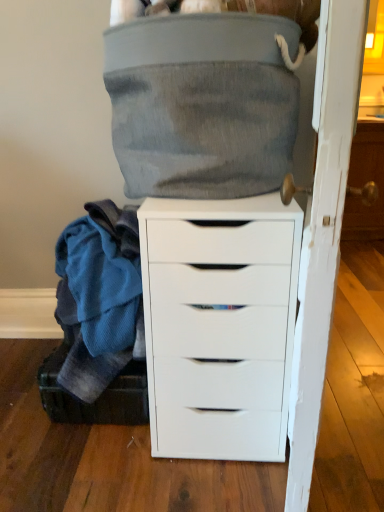
The image size is (384, 512). I want to click on white wood door at right, so click(x=323, y=229).

This screenshot has height=512, width=384. In order to click on white matte chest of drawers at center in this screenshot , I will do `click(219, 324)`.

From a real-world perspective, is black fabric shoe box at lower left physically located above or below white matte chest of drawers at center?

In terms of real-world spatial position, black fabric shoe box at lower left is below white matte chest of drawers at center.

Is black fabric shoe box at lower left facing away from white matte chest of drawers at center?

No, black fabric shoe box at lower left is not facing the opposite direction of white matte chest of drawers at center.

Which of these two, black fabric shoe box at lower left or white matte chest of drawers at center, is smaller?

black fabric shoe box at lower left.

Based on the photo, is white matte chest of drawers at center surrounded by black fabric shoe box at lower left?

No, white matte chest of drawers at center is not inside black fabric shoe box at lower left.

From a real-world perspective, between white matte chest of drawers at center and white wood door at right, who is vertically higher?

In real-world perspective, white wood door at right is above.

Can you confirm if white matte chest of drawers at center is wider than white wood door at right?

Yes.

There is a white matte chest of drawers at center. Identify the location of door above it (from a real-world perspective). This screenshot has width=384, height=512. (323, 229).

Can we say white matte chest of drawers at center lies outside white wood door at right?

Yes, white matte chest of drawers at center is outside of white wood door at right.

From a real-world perspective, is black fabric shoe box at lower left physically below white wood door at right?

Yes, from a real-world perspective, black fabric shoe box at lower left is under white wood door at right.

Which is closer to the camera, (53,410) or (345,92)?

Point (345,92)

Considering the relative sizes of black fabric shoe box at lower left and white wood door at right in the image provided, is black fabric shoe box at lower left shorter than white wood door at right?

Yes, black fabric shoe box at lower left is shorter than white wood door at right.

From the image's perspective, between white matte chest of drawers at center and black fabric shoe box at lower left, who is located below?

From the image's view, black fabric shoe box at lower left is below.

Does white matte chest of drawers at center touch black fabric shoe box at lower left?

No.

Which is correct: white matte chest of drawers at center is inside black fabric shoe box at lower left, or outside of it?

white matte chest of drawers at center lies outside black fabric shoe box at lower left.

Which object is thinner, white matte chest of drawers at center or black fabric shoe box at lower left?

black fabric shoe box at lower left is thinner.

Is white wood door at right inside or outside of black fabric shoe box at lower left?

white wood door at right is outside black fabric shoe box at lower left.

From a real-world perspective, is white wood door at right over black fabric shoe box at lower left?

Yes, from a real-world perspective, white wood door at right is over black fabric shoe box at lower left

Considering the sizes of objects white wood door at right and black fabric shoe box at lower left in the image provided, who is shorter, white wood door at right or black fabric shoe box at lower left?

black fabric shoe box at lower left is shorter.

Does white wood door at right have a greater height compared to white matte chest of drawers at center?

Correct, white wood door at right is much taller as white matte chest of drawers at center.

Would you say white wood door at right is outside white matte chest of drawers at center?

Yes, white wood door at right is outside of white matte chest of drawers at center.

From the image's perspective, does white wood door at right appear lower than white matte chest of drawers at center?

No.

Is white wood door at right placed right next to white matte chest of drawers at center?

No, white wood door at right is not in contact with white matte chest of drawers at center.

At what (x,y) coordinates should I click in order to perform the action: click on shoe box below the white matte chest of drawers at center (from a real-world perspective). Please return your answer as a coordinate pair (x, y). This screenshot has height=512, width=384. Looking at the image, I should click on (98, 398).

You are a GUI agent. You are given a task and a screenshot of the screen. Output one action in this format:
    pyautogui.click(x=<x>, y=<y>)
    Task: Click on the door on the right of white matte chest of drawers at center
    This screenshot has height=512, width=384.
    Given the screenshot: What is the action you would take?
    pyautogui.click(x=323, y=229)

Considering their positions, is white wood door at right positioned closer to black fabric shoe box at lower left than white matte chest of drawers at center?

Based on the image, white matte chest of drawers at center appears to be nearer to black fabric shoe box at lower left.

Considering their positions, is white matte chest of drawers at center positioned closer to black fabric shoe box at lower left than white wood door at right?

Among the two, white matte chest of drawers at center is located nearer to black fabric shoe box at lower left.

From the image, which object appears to be farther from white wood door at right, white matte chest of drawers at center or black fabric shoe box at lower left?

black fabric shoe box at lower left.

Based on their spatial positions, is black fabric shoe box at lower left or white wood door at right further from white matte chest of drawers at center?

black fabric shoe box at lower left.

Based on the photo, estimate the real-world distances between objects in this image. Which object is closer to white wood door at right, black fabric shoe box at lower left or white matte chest of drawers at center?

white matte chest of drawers at center.

Which object lies nearer to the anchor point white matte chest of drawers at center, white wood door at right or black fabric shoe box at lower left?

Based on the image, white wood door at right appears to be nearer to white matte chest of drawers at center.

Where is `chest of drawers between black fabric shoe box at lower left and white wood door at right from left to right`? chest of drawers between black fabric shoe box at lower left and white wood door at right from left to right is located at coordinates click(219, 324).